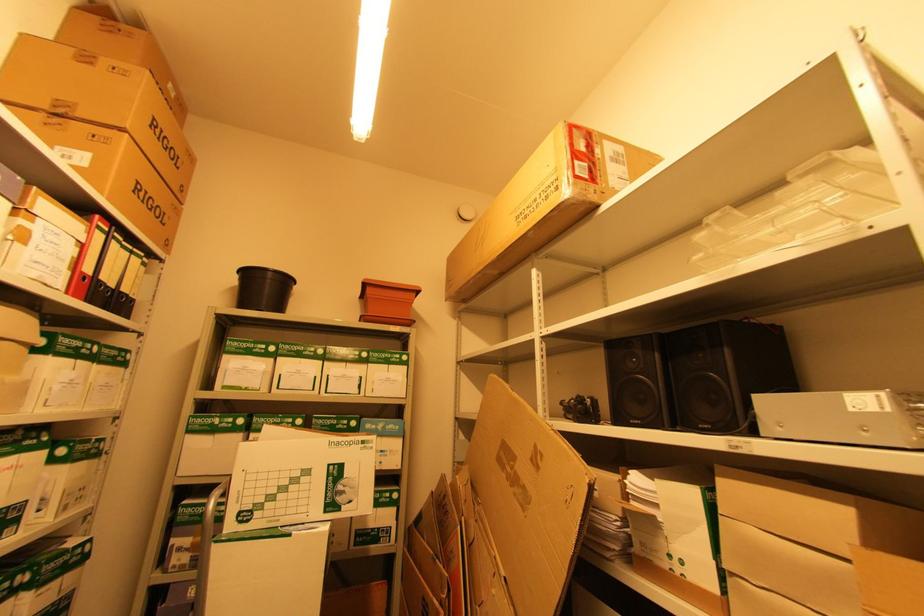
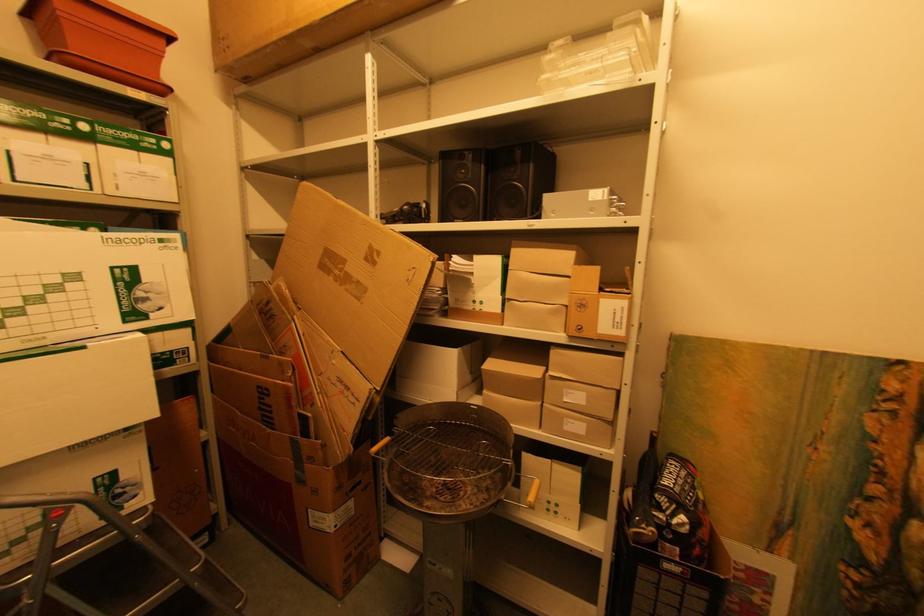
First-person continuous shooting, in which direction is the camera rotating?

The camera's rotation is toward right-down.